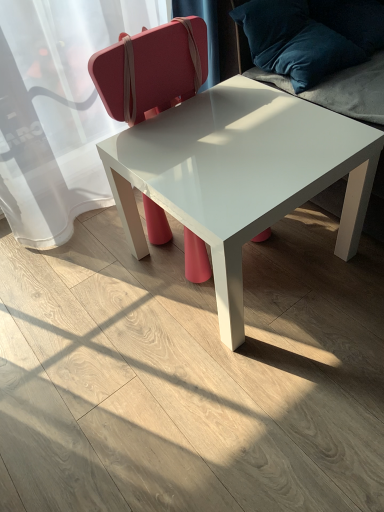
Identify the location of vacant area that is in front of white glossy table at center. This screenshot has width=384, height=512. (253, 389).